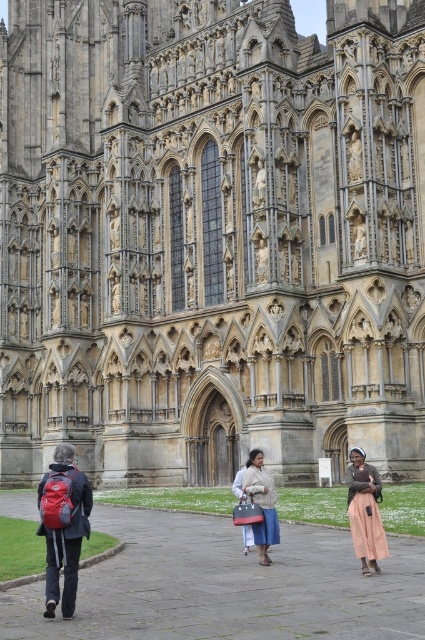
What do you see at coordinates (62, 525) in the screenshot?
I see `red fabric backpack at lower left` at bounding box center [62, 525].

Between point (59, 477) and point (244, 484), which one is positioned behind?

The point (244, 484) is more distant.

In order to click on red fabric backpack at lower left in this screenshot , I will do `click(62, 525)`.

Who is higher up, peach cotton dress at lower right or light brown fabric coat at center?

peach cotton dress at lower right is above.

How far apart are peach cotton dress at lower right and light brown fabric coat at center?

peach cotton dress at lower right and light brown fabric coat at center are 11.88 feet apart from each other.

Between point (363, 483) and point (274, 497), which one is positioned in front?

Point (363, 483) is more forward.

The width and height of the screenshot is (425, 640). In order to click on peach cotton dress at lower right in this screenshot , I will do `click(365, 512)`.

Who is lower down, red fabric backpack at lower left or peach cotton dress at lower right?

red fabric backpack at lower left

In the scene shown: Does red fabric backpack at lower left appear on the right side of peach cotton dress at lower right?

Incorrect, red fabric backpack at lower left is not on the right side of peach cotton dress at lower right.

Which is in front, point (57, 465) or point (354, 518)?

Point (57, 465) is in front.

At what (x,y) coordinates should I click in order to perform the action: click on red fabric backpack at lower left. Please return your answer as a coordinate pair (x, y). The image size is (425, 640). Looking at the image, I should click on (62, 525).